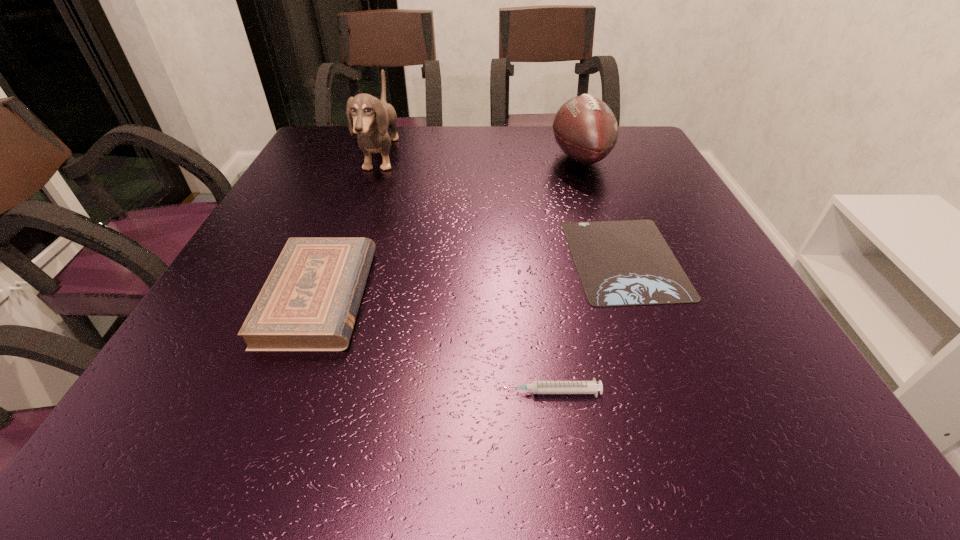
Identify the location of vacant area in the image that satisfies the following two spatial constraints: 1. on the front side of the mousepad; 2. at the needle end of the second shortest object. (675, 392).

Identify the location of vacant space that satisfies the following two spatial constraints: 1. at the face of the tallest object; 2. on the left side of the football (American). (381, 158).